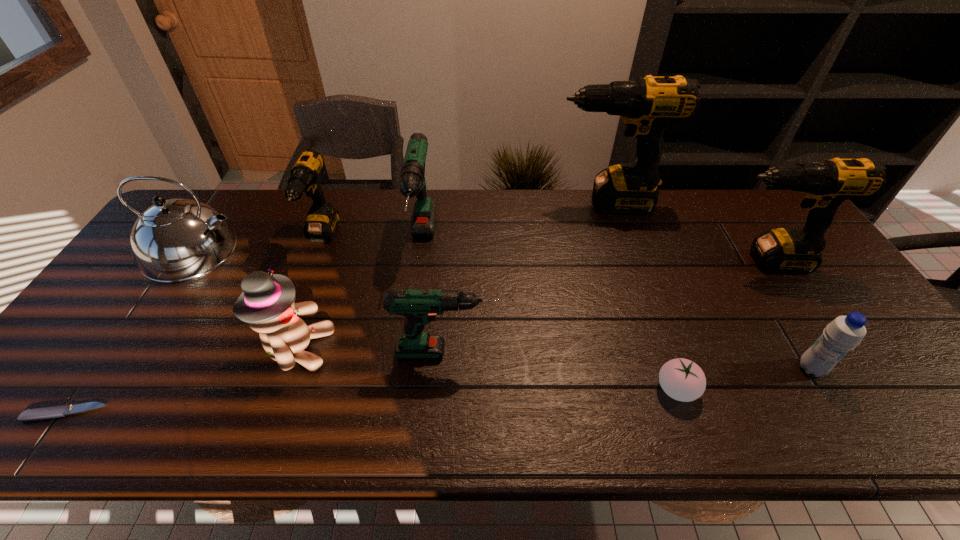
At what (x,y) coordinates should I click in order to perform the action: click on vacant space that is in between the bigger green drill and the leftmost drill. Please return your answer as a coordinate pair (x, y). The image size is (960, 540). Looking at the image, I should click on (372, 240).

Find the location of a particular element. object that is the sixth nearest to the kettle is located at coordinates (648, 105).

Where is `object that is the sixth closest to the nearest drill`? object that is the sixth closest to the nearest drill is located at coordinates (175, 240).

Identify which drill is the fifth nearest to the steak knife. Please provide its 2D coordinates. Your answer should be formatted as a tuple, i.e. [(x, y)], where the tuple contains the x and y coordinates of a point satisfying the conditions above.

[(825, 184)]

Image resolution: width=960 pixels, height=540 pixels. Find the location of `drill that can be found as the second closest to the kettle`. drill that can be found as the second closest to the kettle is located at coordinates (412, 180).

At what (x,y) coordinates should I click in order to perform the action: click on black drill that can be found as the second closest to the kettle. Please return your answer as a coordinate pair (x, y). Looking at the image, I should click on (648, 105).

Where is `black drill that is the second closest to the tallest object`? Image resolution: width=960 pixels, height=540 pixels. black drill that is the second closest to the tallest object is located at coordinates (322, 220).

Locate an element on the screen. The width and height of the screenshot is (960, 540). vacant space that satisfies the following two spatial constraints: 1. on the back side of the red tomato; 2. at the tip of the second drill from right to left is located at coordinates (612, 203).

The image size is (960, 540). I want to click on vacant space that satisfies the following two spatial constraints: 1. at the tip of the biggest black drill; 2. at the tip of the leftmost drill, so click(617, 237).

Locate an element on the screen. free space that satisfies the following two spatial constraints: 1. on the handle side of the farther green drill; 2. from the spout of the kettle is located at coordinates (421, 251).